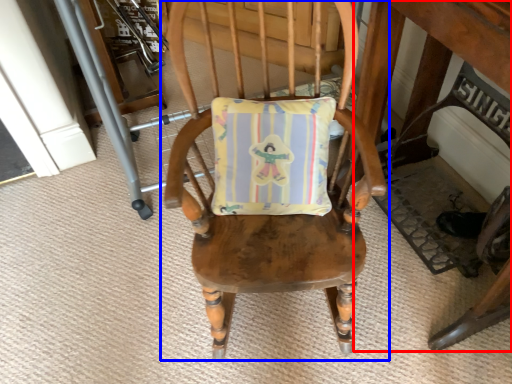
Question: Which of the following is the farthest to the observer, table (highlighted by a red box) or chair (highlighted by a blue box)?

Choices:
 (A) table
 (B) chair

Answer: (B)